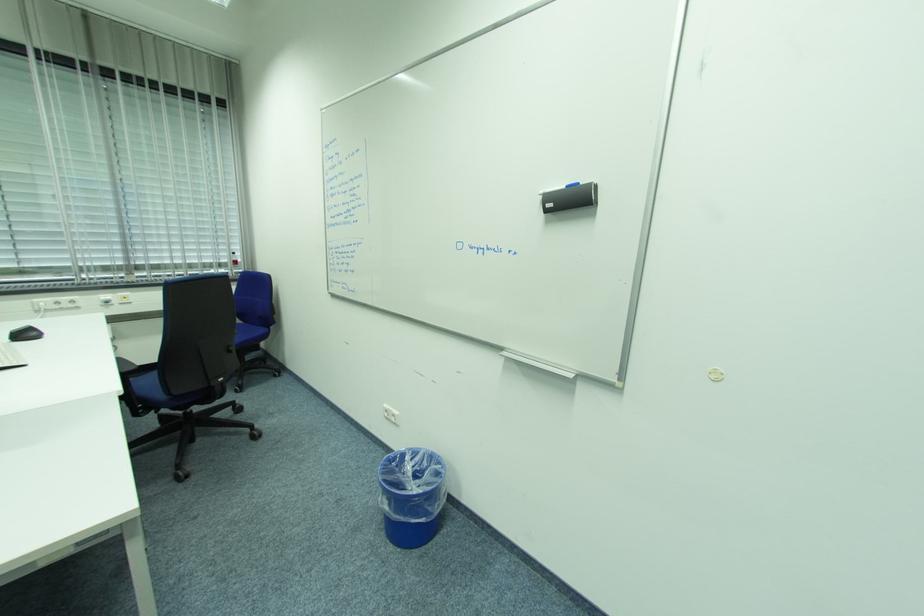
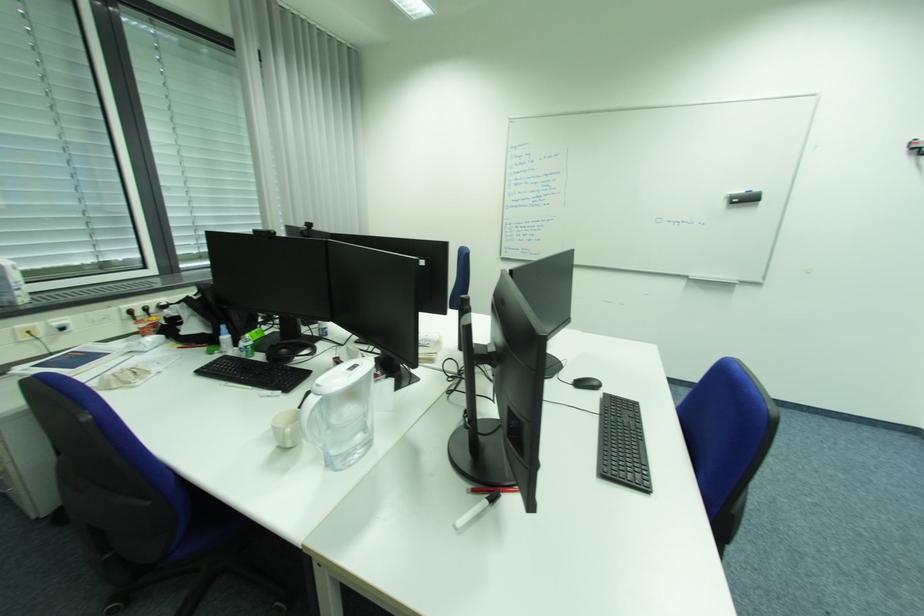
Question: What movement of the cameraman would produce the second image?

Choices:
 (A) Left
 (B) Right
 (C) Forward
 (D) Backward

Answer: (A)